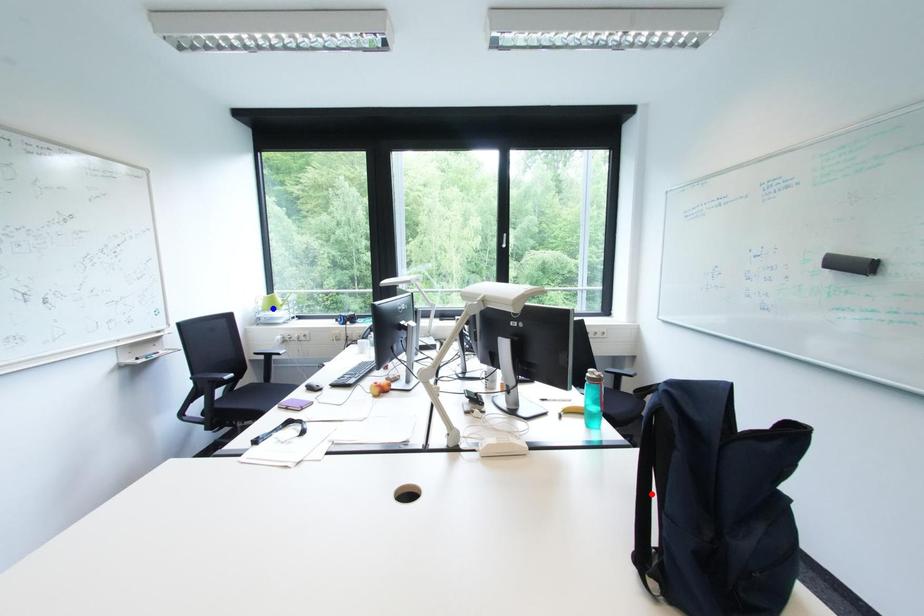
Question: Two points are marked on the image. Which point is closer to the camera?

Choices:
 (A) Blue point is closer.
 (B) Red point is closer.

Answer: (B)